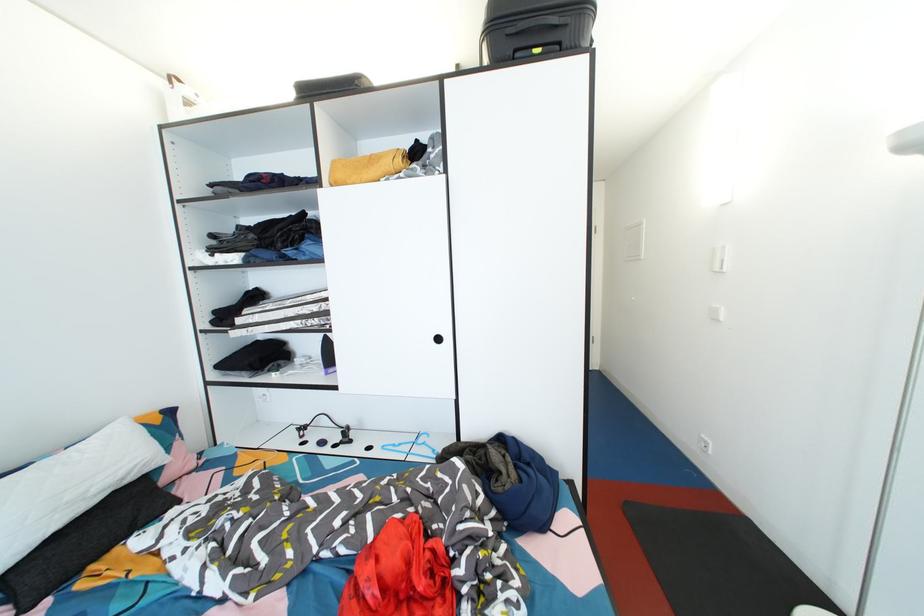
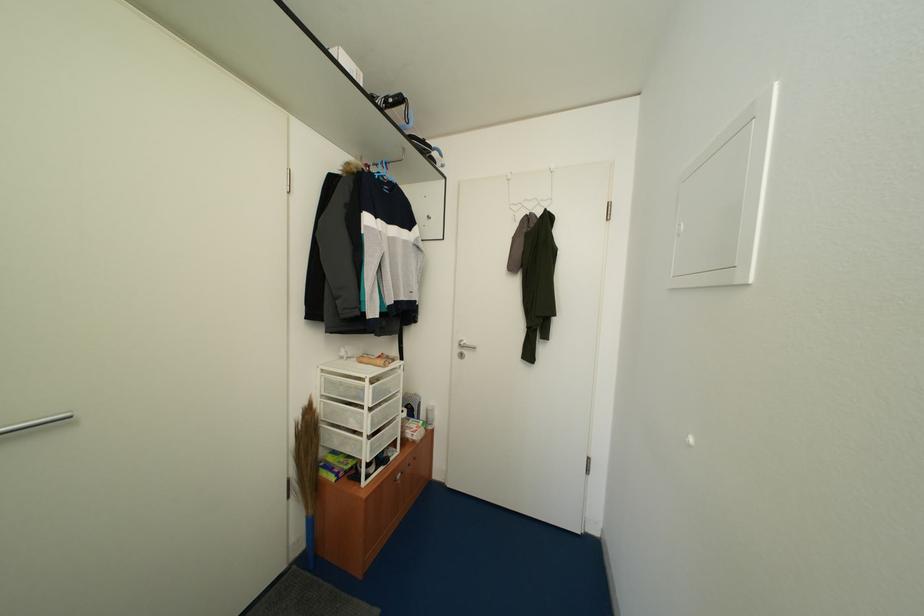
What movement of the cameraman would produce the second image?

The movement direction of the cameraman is right, forward.